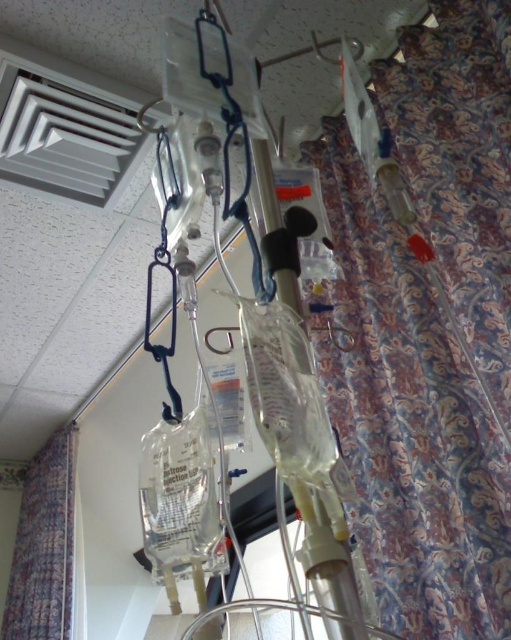
Can you confirm if patterned fabric curtain at right is wider than patterned fabric curtain at left?

In fact, patterned fabric curtain at right might be narrower than patterned fabric curtain at left.

Is patterned fabric curtain at right to the left of patterned fabric curtain at left from the viewer's perspective?

In fact, patterned fabric curtain at right is to the right of patterned fabric curtain at left.

Between point (336, 164) and point (36, 611), which one is positioned in front?

Positioned in front is point (336, 164).

Identify the location of patterned fabric curtain at right. (410, 422).